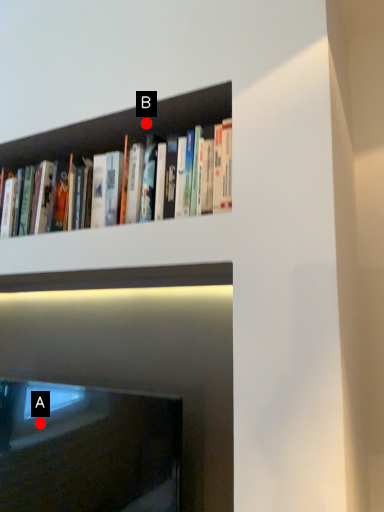
Question: Two points are circled on the image, labeled by A and B beside each circle. Which point is closer to the camera?

Choices:
 (A) A is closer
 (B) B is closer

Answer: (B)